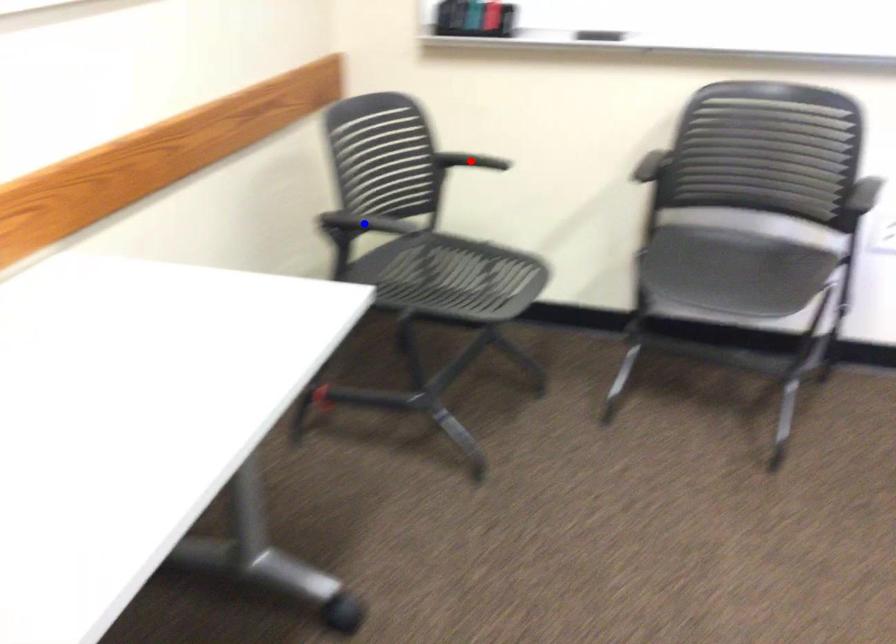
Question: In the image, two points are highlighted. Which point is nearer to the camera? Reply with the corresponding letter.

Choices:
 (A) blue point
 (B) red point

Answer: (A)